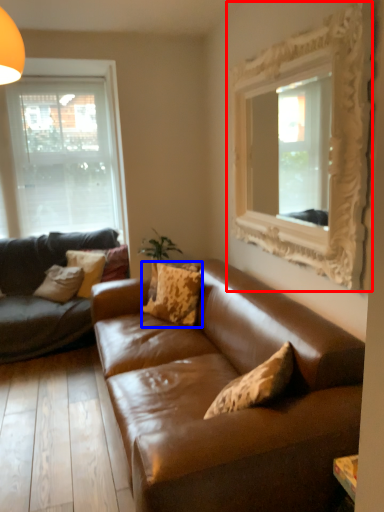
Question: Which point is further to the camera, picture frame (highlighted by a red box) or pillow (highlighted by a blue box)?

Choices:
 (A) picture frame
 (B) pillow

Answer: (B)